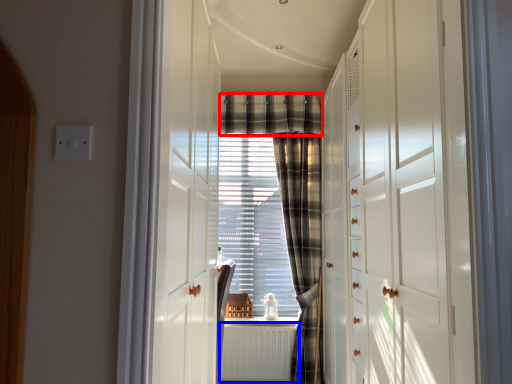
Question: Among these objects, which one is farthest to the camera, plaid (highlighted by a red box) or radiator (highlighted by a blue box)?

Choices:
 (A) plaid
 (B) radiator

Answer: (A)